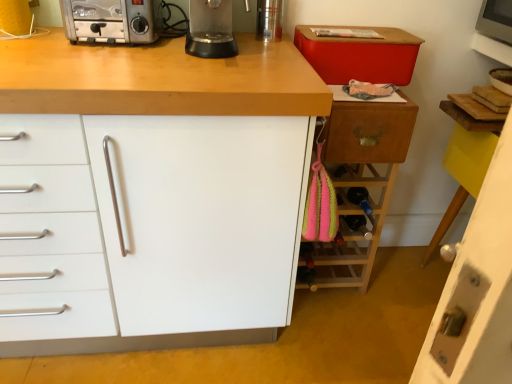
The height and width of the screenshot is (384, 512). In order to click on vacant space situated on the left part of white glossy door at lower right, the 1th cabinetry in the right-to-left sequence in this screenshot , I will do `click(378, 314)`.